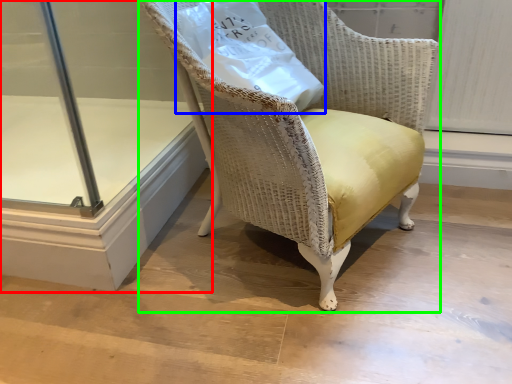
Question: Based on their relative distances, which object is farther from glass door (highlighted by a red box)? Choose from paper bag (highlighted by a blue box) and chair (highlighted by a green box).

Choices:
 (A) paper bag
 (B) chair

Answer: (A)